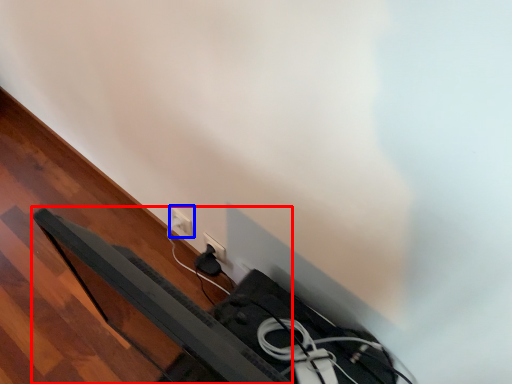
Question: Which point is closer to the camera, bed frame (highlighted by a red box) or power plugs and sockets (highlighted by a blue box)?

Choices:
 (A) bed frame
 (B) power plugs and sockets

Answer: (A)